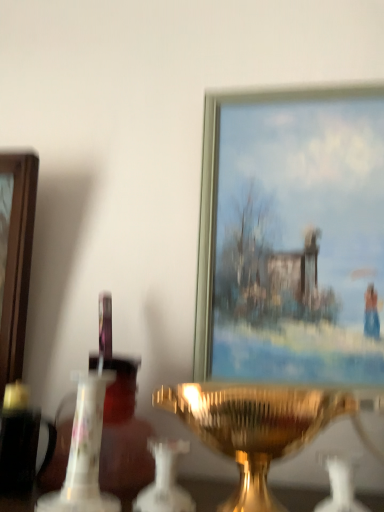
Question: In the image, is white glass candle holder at center, the third candle holder in the left-to-right sequence, on the left side or the right side of metallic gold picture frame at upper center?

Choices:
 (A) right
 (B) left

Answer: (B)

Question: From a real-world perspective, is white glass candle holder at center, the first candle holder when ordered from right to left, above or below metallic gold picture frame at upper center?

Choices:
 (A) below
 (B) above

Answer: (A)

Question: Which object is positioned closest to the metallic gold picture frame at upper center?

Choices:
 (A) white glass candle holder at center, the first candle holder when ordered from right to left
 (B) gold metallic candle holder at center, the second candle holder in the left-to-right sequence
 (C) white porcelain candle holder at center, acting as the 1th candle holder starting from the left

Answer: (B)

Question: Which object is the closest to the white porcelain candle holder at center, acting as the 1th candle holder starting from the left?

Choices:
 (A) metallic gold picture frame at upper center
 (B) white glass candle holder at center, the third candle holder in the left-to-right sequence
 (C) gold metallic candle holder at center, the second candle holder in the left-to-right sequence

Answer: (C)